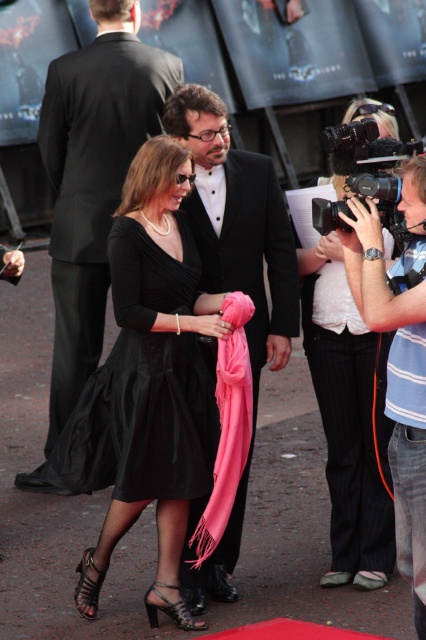
Question: Where is black leather sandal at lower left located in relation to black leather sandal at lower center in the image?

Choices:
 (A) below
 (B) above

Answer: (B)

Question: Which object appears closest to the camera in this image?

Choices:
 (A) matte black camera at right
 (B) matte black suit at center
 (C) satin black dress at center

Answer: (A)

Question: Which object is positioned farthest from the satin black dress at center?

Choices:
 (A) shiny black suit at center
 (B) matte black dress at center

Answer: (A)

Question: Which point is farther from the camera taking this photo?

Choices:
 (A) (186, 618)
 (B) (103, 573)

Answer: (B)

Question: Is matte black suit at center thinner than matte black camera at right?

Choices:
 (A) no
 (B) yes

Answer: (A)

Question: Does matte black dress at center have a smaller size compared to black leather sandal at lower left?

Choices:
 (A) yes
 (B) no

Answer: (B)